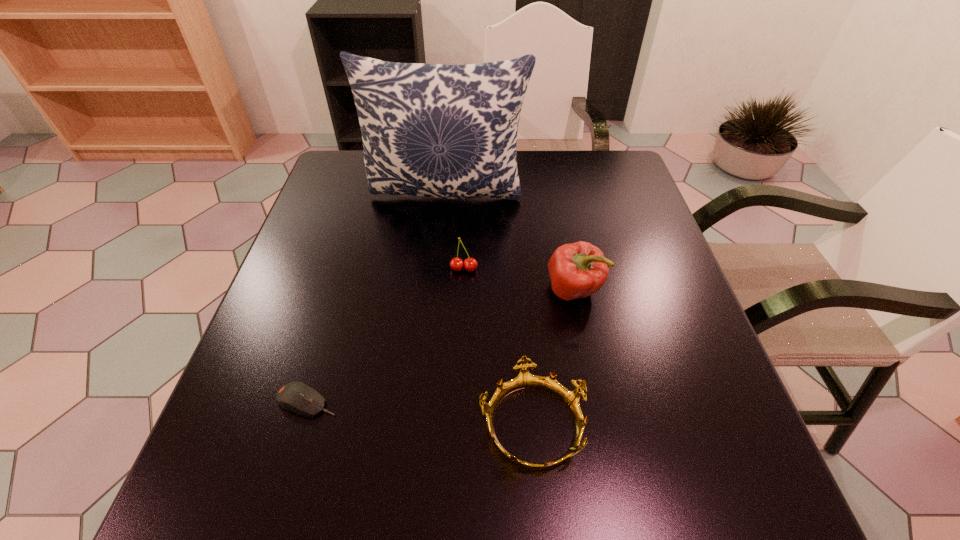
Locate an element on the screen. The height and width of the screenshot is (540, 960). cushion is located at coordinates (x=432, y=130).

You are a GUI agent. You are given a task and a screenshot of the screen. Output one action in this format:
    pyautogui.click(x=<x>, y=<y>)
    Task: Click on the farthest object
    
    Given the screenshot: What is the action you would take?
    pyautogui.click(x=432, y=130)

Locate an element on the screen. the second tallest object is located at coordinates (577, 270).

Find the location of a particular element. The width and height of the screenshot is (960, 540). cherry is located at coordinates (470, 264).

Identify the location of the fourth tallest object. (524, 380).

Find the location of a particular element. the shortest object is located at coordinates (297, 397).

At what (x,y) coordinates should I click in order to perform the action: click on free point located on the front surface of the cushion. Please return your answer as a coordinate pair (x, y). The image size is (960, 540). Looking at the image, I should click on (435, 325).

I want to click on vacant space situated on the back of the second tallest object, so pyautogui.click(x=557, y=204).

At what (x,y) coordinates should I click in order to perform the action: click on free space located with the stems of the cherry pointing upwards. Please return your answer as a coordinate pair (x, y). Looking at the image, I should click on (460, 383).

At what (x,y) coordinates should I click in order to perform the action: click on free space located 0.350m on the left of the crown. Please return your answer as a coordinate pair (x, y). The image size is (960, 540). Looking at the image, I should click on (275, 423).